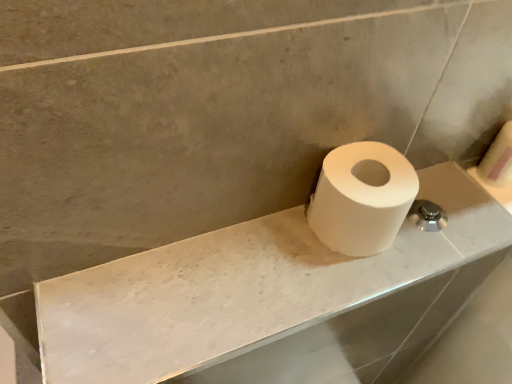
I want to click on free space to the left of white matte toilet paper at right, the second toilet paper from the right, so click(x=243, y=254).